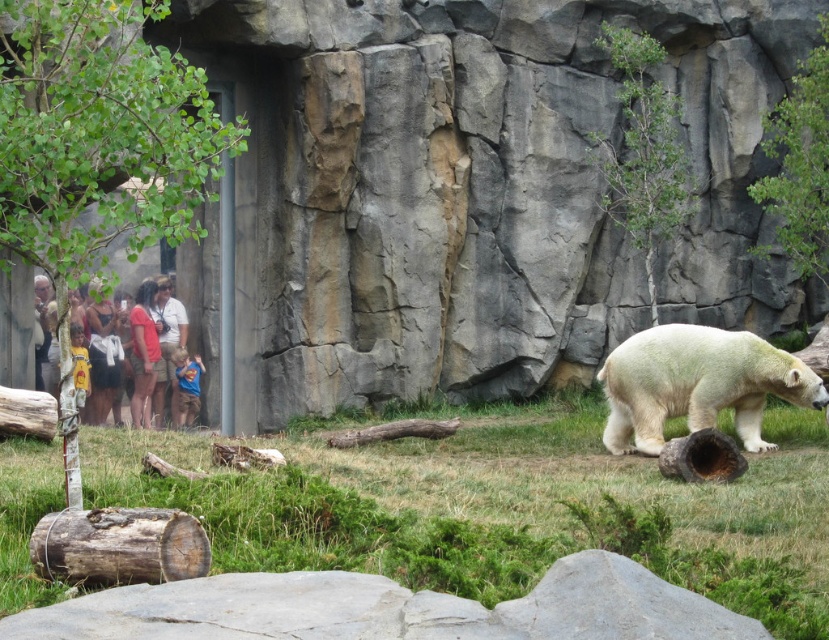
Between green leafy tree at left and gray rough rock at lower center, which one appears on the right side from the viewer's perspective?

Positioned to the right is gray rough rock at lower center.

Locate an element on the screen. This screenshot has width=829, height=640. green leafy tree at left is located at coordinates (99, 134).

Is brown rough log at center behind blue cotton shirt at center?

No.

Is brown rough log at center wider than blue cotton shirt at center?

Correct, the width of brown rough log at center exceeds that of blue cotton shirt at center.

Locate an element on the screen. The width and height of the screenshot is (829, 640). brown rough log at center is located at coordinates (394, 432).

Locate an element on the screen. brown rough log at center is located at coordinates (394, 432).

Based on the photo, between green leafy tree at upper center and weathered brown log at lower left, which one is positioned lower?

Positioned lower is weathered brown log at lower left.

Does green leafy tree at upper center have a smaller size compared to weathered brown log at lower left?

Incorrect, green leafy tree at upper center is not smaller in size than weathered brown log at lower left.

Locate an element on the screen. The height and width of the screenshot is (640, 829). green leafy tree at upper center is located at coordinates (643, 150).